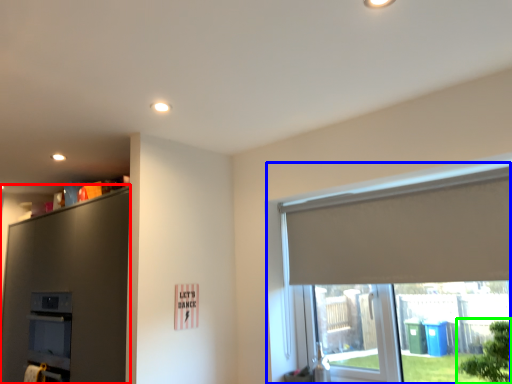
Question: Which object is positioned farthest from dresser (highlighted by a red box)? Select from window (highlighted by a blue box) and tree (highlighted by a green box).

Choices:
 (A) window
 (B) tree

Answer: (B)